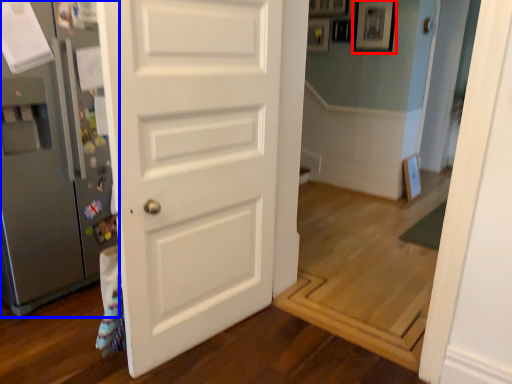
Question: Which of the following is the farthest to the observer, picture frame (highlighted by a red box) or refrigerator (highlighted by a blue box)?

Choices:
 (A) picture frame
 (B) refrigerator

Answer: (A)